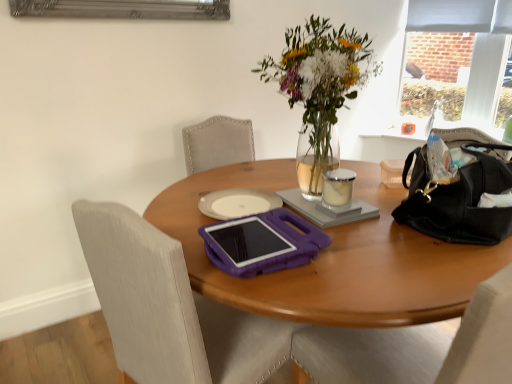
Question: Does gray matte notebook at center lie in front of purple plastic chair at center?

Choices:
 (A) no
 (B) yes

Answer: (A)

Question: Considering the relative sizes of gray matte notebook at center and purple plastic chair at center in the image provided, is gray matte notebook at center bigger than purple plastic chair at center?

Choices:
 (A) yes
 (B) no

Answer: (B)

Question: From a real-world perspective, is gray matte notebook at center physically above purple plastic chair at center?

Choices:
 (A) no
 (B) yes

Answer: (B)

Question: Does gray matte notebook at center appear on the right side of purple plastic chair at center?

Choices:
 (A) no
 (B) yes

Answer: (B)

Question: Is gray matte notebook at center positioned with its back to purple plastic chair at center?

Choices:
 (A) yes
 (B) no

Answer: (B)

Question: Is white matte notepad at center wider or thinner than gray matte notebook at center?

Choices:
 (A) thin
 (B) wide

Answer: (A)

Question: Is white matte notepad at center spatially inside gray matte notebook at center, or outside of it?

Choices:
 (A) outside
 (B) inside

Answer: (A)

Question: From their relative heights in the image, would you say white matte notepad at center is taller or shorter than gray matte notebook at center?

Choices:
 (A) short
 (B) tall

Answer: (A)

Question: Based on their sizes in the image, would you say white matte notepad at center is bigger or smaller than gray matte notebook at center?

Choices:
 (A) small
 (B) big

Answer: (A)

Question: Considering the positions of matte gray curtain at upper right and gray matte notebook at center in the image, is matte gray curtain at upper right bigger or smaller than gray matte notebook at center?

Choices:
 (A) small
 (B) big

Answer: (B)

Question: Visually, is matte gray curtain at upper right positioned to the left or to the right of gray matte notebook at center?

Choices:
 (A) left
 (B) right

Answer: (B)

Question: Choose the correct answer: Is matte gray curtain at upper right inside gray matte notebook at center or outside it?

Choices:
 (A) inside
 (B) outside

Answer: (B)

Question: From the image's perspective, relative to gray matte notebook at center, is matte gray curtain at upper right above or below?

Choices:
 (A) below
 (B) above

Answer: (B)

Question: From the image's perspective, is purple plastic chair at center above or below purple plastic tablet at center?

Choices:
 (A) above
 (B) below

Answer: (B)

Question: Relative to purple plastic tablet at center, is purple plastic chair at center in front or behind?

Choices:
 (A) behind
 (B) front

Answer: (B)